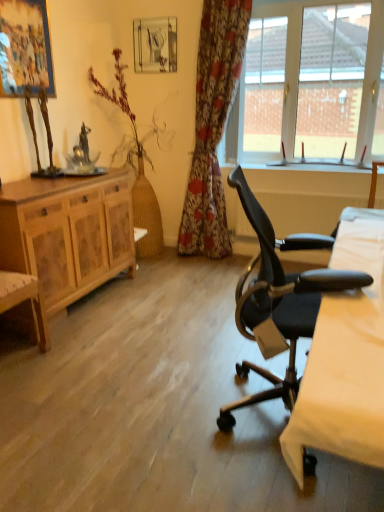
What are the coordinates of `vacant space positioned to the left of black leather office chair at right` in the screenshot? It's located at (167, 430).